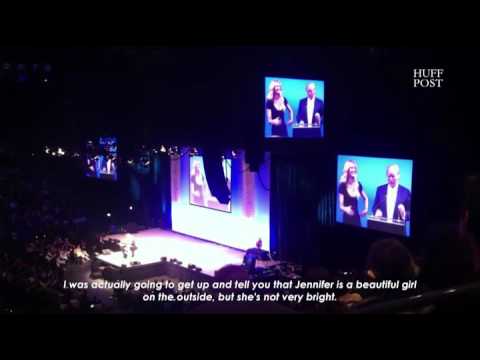
This screenshot has width=480, height=360. What are the coordinates of `screen` in the screenshot? It's located at (294, 92).